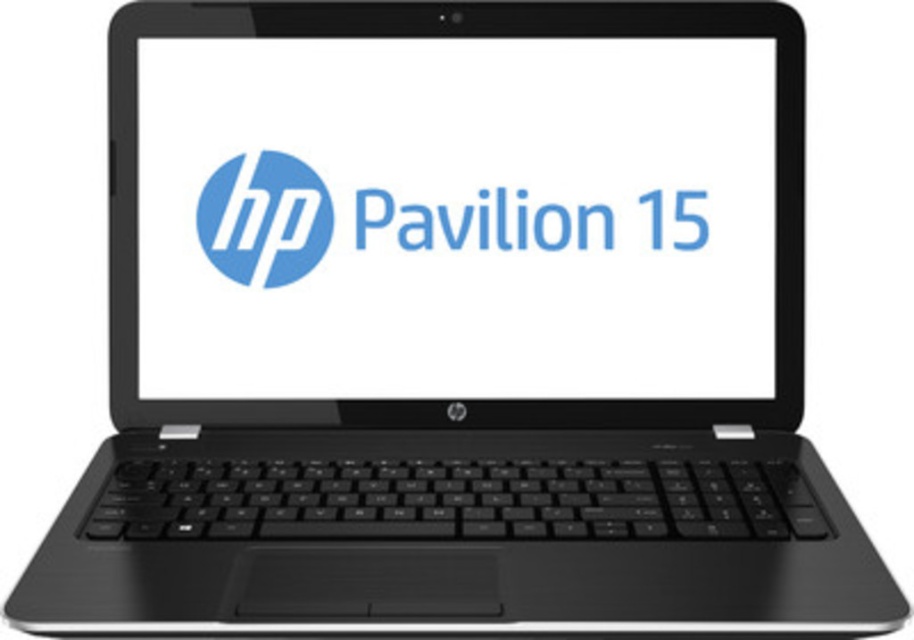
You are setting up a desk and want to place both the matte black laptop at center and the matte blue circle at center on it. Given their sizes, which object should you place first to ensure they both fit comfortably?

The matte black laptop at center is wider than the matte blue circle at center, so you should place the matte black laptop at center first to ensure there is enough space for both objects on the desk.

You are looking at the HP Pavilion 15 laptop screen. There are two points on the screen at coordinates point (254, 236) and point (275, 237). Which point is closer to your eyes?

Point (254, 236) is closer to the camera than point (275, 237).

From the picture: Where is the matte black laptop at center located in the image?

The matte black laptop at center is located at point (457,218) in the image.